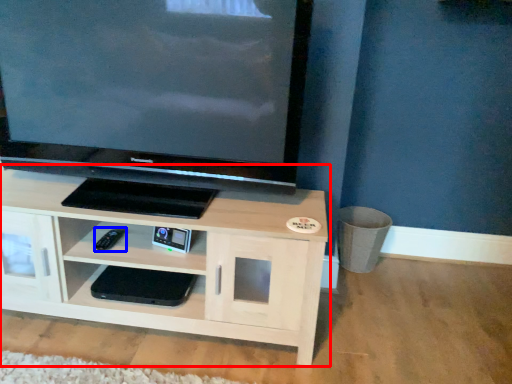
Question: Among these objects, which one is farthest to the camera, shelf (highlighted by a red box) or remote (highlighted by a blue box)?

Choices:
 (A) shelf
 (B) remote

Answer: (B)